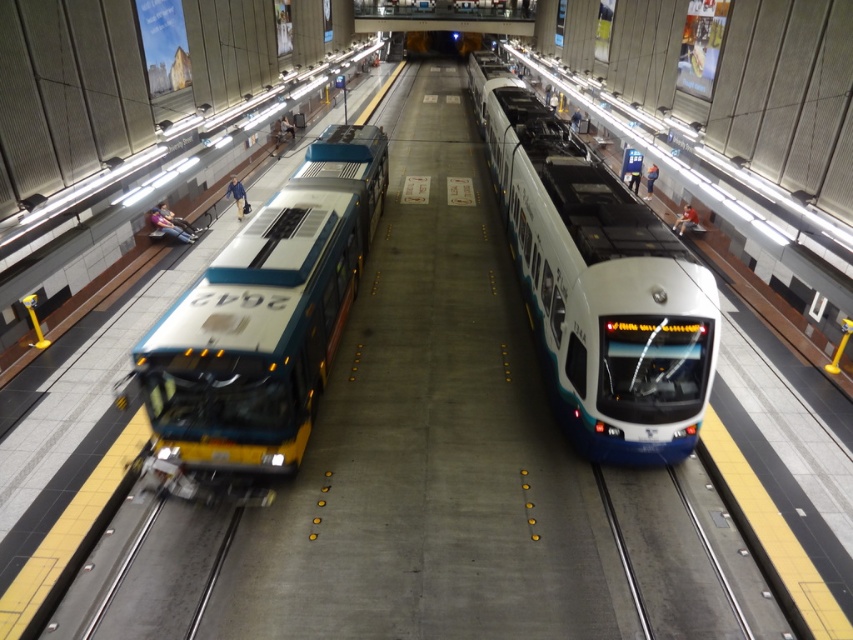
You are a maintenance worker needing to inspect both the white glossy train at center and the teal glossy bus at left. Given that you can only carry tools for one vehicle at a time, which vehicle should you inspect first to minimize walking distance?

You should inspect the teal glossy bus at left first because it is closer to the starting point. Since the white glossy train at center is 5.82 meters away from the teal glossy bus at left, the bus is nearer, so starting there reduces the total distance traveled.

From the picture: You are a passenger at the train station and want to board the white glossy train at center. However, you notice the teal glossy bus at left is blocking the entrance. Can you walk around the bus to reach the train?

The white glossy train at center is above the teal glossy bus at left, so you can walk around the bus since the train is elevated and not directly blocking the entrance.

You are standing at the train station and want to determine which of the two points, point [675,426] or point [228,268], is closer to you. Based on the image, which point is nearer?

Point [675,426] is closer to the viewer than point [228,268].